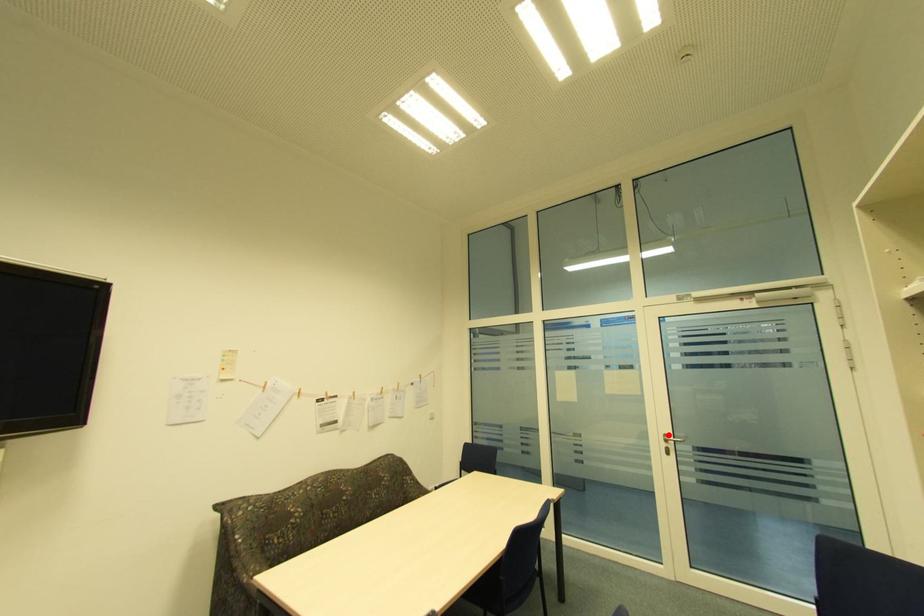
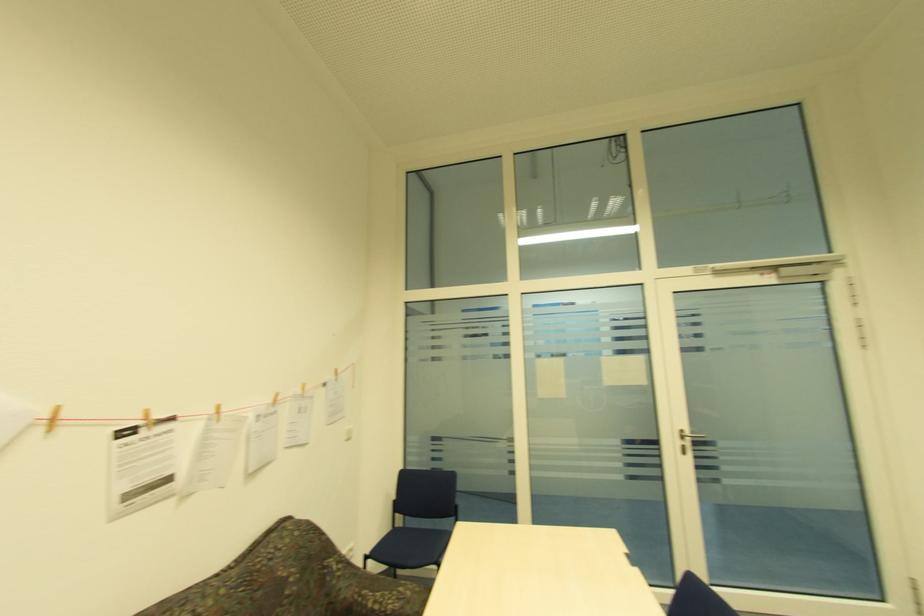
Where in the second image is the point corresponding to the highlighted location from the first image?

(685, 432)